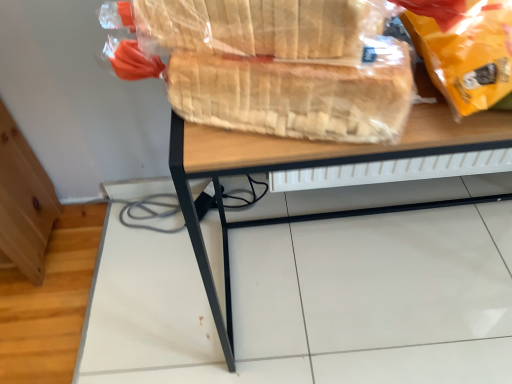
Question: Does translucent plastic bread at center, placed as the first bread when sorted from bottom to top, touch translucent plastic bread at upper center, acting as the first bread starting from the top?

Choices:
 (A) no
 (B) yes

Answer: (B)

Question: Is translucent plastic bread at center, placed as the first bread when sorted from bottom to top, surrounding translucent plastic bread at upper center, acting as the first bread starting from the top?

Choices:
 (A) no
 (B) yes

Answer: (A)

Question: From a real-world perspective, is translucent plastic bread at center, the 2th bread from the top, positioned over translucent plastic bread at upper center, acting as the first bread starting from the top, based on gravity?

Choices:
 (A) no
 (B) yes

Answer: (A)

Question: Is translucent plastic bread at center, placed as the first bread when sorted from bottom to top, taller than translucent plastic bread at upper center, the second bread ordered from the bottom?

Choices:
 (A) no
 (B) yes

Answer: (A)

Question: From the image's perspective, is translucent plastic bread at center, placed as the first bread when sorted from bottom to top, below translucent plastic bread at upper center, acting as the first bread starting from the top?

Choices:
 (A) no
 (B) yes

Answer: (B)

Question: Considering the positions of translucent plastic bread at upper center, acting as the first bread starting from the top, and translucent plastic bread at center, the 2th bread from the top, in the image, is translucent plastic bread at upper center, acting as the first bread starting from the top, bigger or smaller than translucent plastic bread at center, the 2th bread from the top,?

Choices:
 (A) small
 (B) big

Answer: (B)

Question: Do you think translucent plastic bread at upper center, acting as the first bread starting from the top, is within translucent plastic bread at center, the 2th bread from the top, or outside of it?

Choices:
 (A) outside
 (B) inside

Answer: (A)

Question: From their relative heights in the image, would you say translucent plastic bread at upper center, the second bread ordered from the bottom, is taller or shorter than translucent plastic bread at center, the 2th bread from the top?

Choices:
 (A) tall
 (B) short

Answer: (A)

Question: Does point (250, 0) appear closer or farther from the camera than point (304, 89)?

Choices:
 (A) closer
 (B) farther

Answer: (A)

Question: From the image's perspective, relative to translucent plastic bread at center, placed as the first bread when sorted from bottom to top, is wooden desk at center above or below?

Choices:
 (A) above
 (B) below

Answer: (B)

Question: Considering the positions of wooden desk at center and translucent plastic bread at center, the 2th bread from the top, in the image, is wooden desk at center taller or shorter than translucent plastic bread at center, the 2th bread from the top,?

Choices:
 (A) tall
 (B) short

Answer: (A)

Question: Do you think wooden desk at center is within translucent plastic bread at center, placed as the first bread when sorted from bottom to top, or outside of it?

Choices:
 (A) inside
 (B) outside

Answer: (B)

Question: Is wooden desk at center wider or thinner than translucent plastic bread at center, placed as the first bread when sorted from bottom to top?

Choices:
 (A) thin
 (B) wide

Answer: (B)

Question: In terms of height, does translucent plastic bread at upper center, the second bread ordered from the bottom, look taller or shorter compared to wooden desk at center?

Choices:
 (A) short
 (B) tall

Answer: (A)

Question: Is translucent plastic bread at upper center, the second bread ordered from the bottom, inside or outside of wooden desk at center?

Choices:
 (A) inside
 (B) outside

Answer: (B)